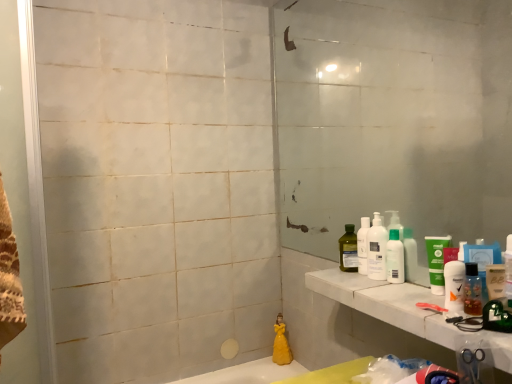
You are a GUI agent. You are given a task and a screenshot of the screen. Output one action in this format:
    pyautogui.click(x=<x>, y=<y>)
    Task: Click on the vacant area that is in front of translucent plastic bottle at right, marked as the second mouthwash in a back-to-front arrangement
    The image size is (512, 384).
    Given the screenshot: What is the action you would take?
    pyautogui.click(x=485, y=327)